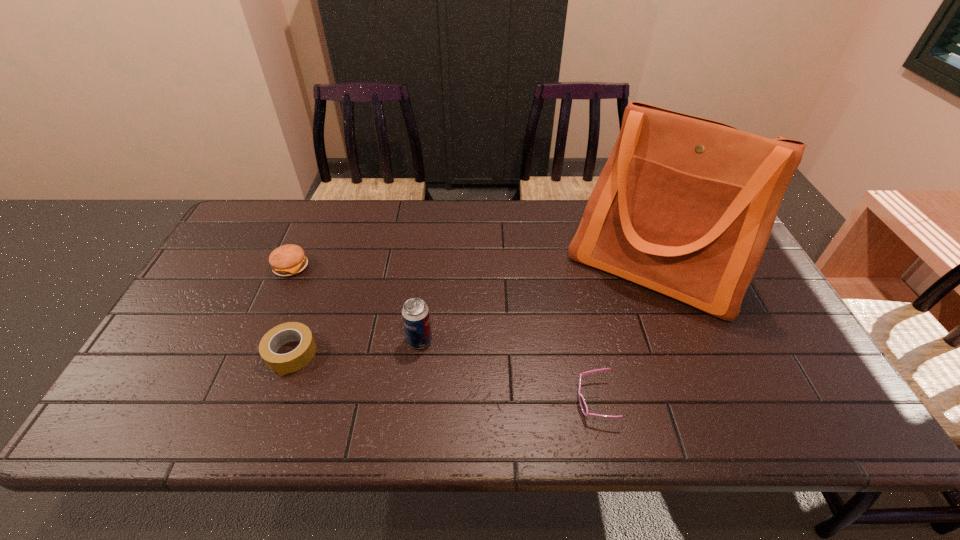
Where is `vacant space located on the front-facing side of the nearest object`? The width and height of the screenshot is (960, 540). vacant space located on the front-facing side of the nearest object is located at coordinates (501, 401).

Locate an element on the screen. free region located on the front-facing side of the nearest object is located at coordinates (518, 401).

At what (x,y) coordinates should I click in order to perform the action: click on vacant space located 0.250m on the front-facing side of the nearest object. Please return your answer as a coordinate pair (x, y). The width and height of the screenshot is (960, 540). Looking at the image, I should click on (466, 401).

Where is `object that is at the far edge`? The width and height of the screenshot is (960, 540). object that is at the far edge is located at coordinates (684, 206).

Locate an element on the screen. Image resolution: width=960 pixels, height=540 pixels. object that is at the near edge is located at coordinates (583, 405).

Image resolution: width=960 pixels, height=540 pixels. Identify the location of object at the right edge. (684, 206).

Locate an element on the screen. This screenshot has width=960, height=540. object located in the far right corner section of the desktop is located at coordinates (684, 206).

In the image, there is a desktop. Where is `free region at the far edge`? The height and width of the screenshot is (540, 960). free region at the far edge is located at coordinates (444, 205).

Where is `vacant space at the near edge of the desktop`? This screenshot has height=540, width=960. vacant space at the near edge of the desktop is located at coordinates (694, 434).

In the image, there is a desktop. Where is `free space at the left edge`? This screenshot has width=960, height=540. free space at the left edge is located at coordinates (194, 340).